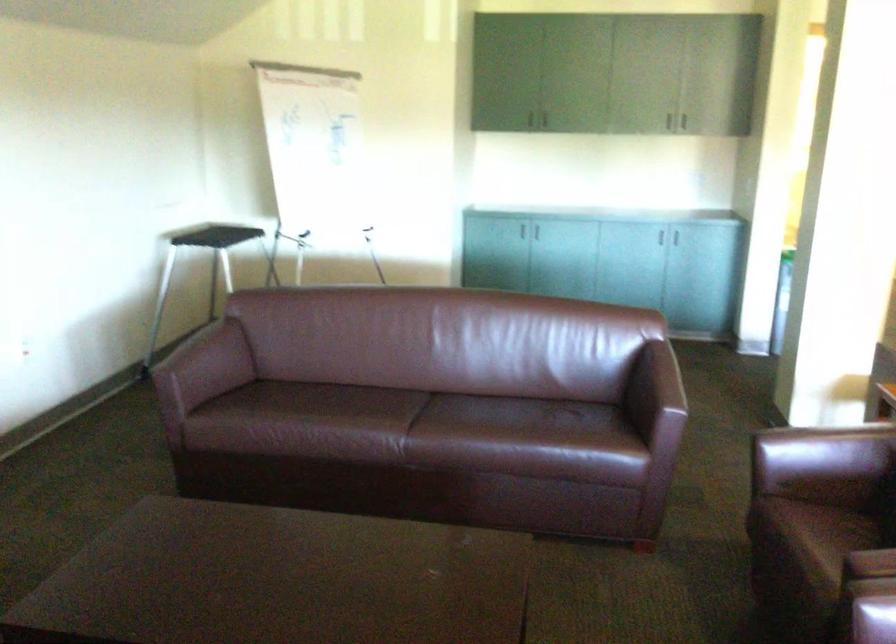
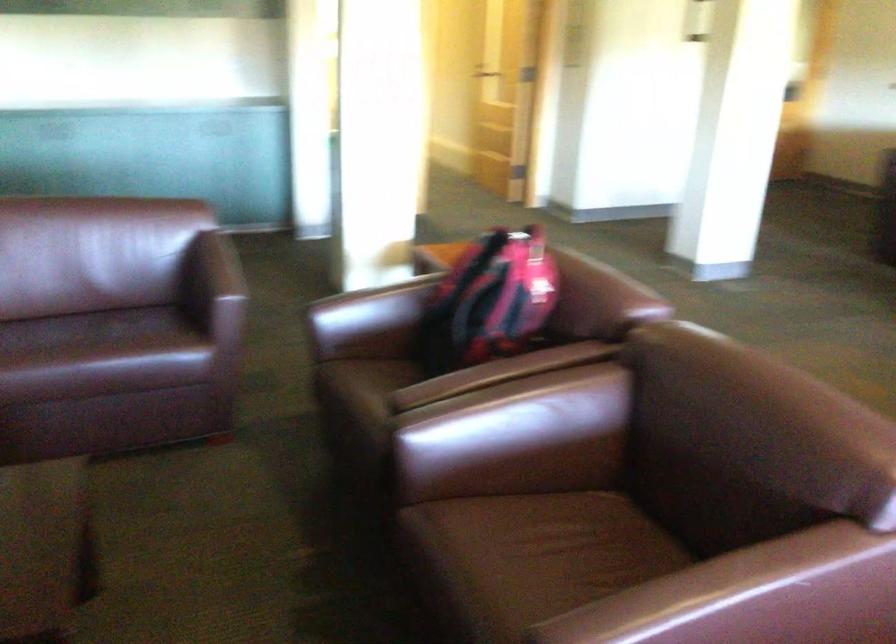
Based on the continuous images, in which direction is the camera rotating?

The camera rotated toward right-down.